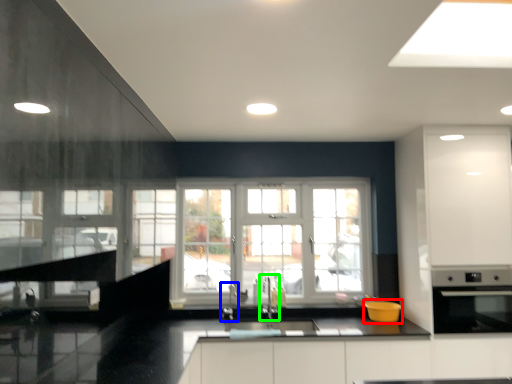
Question: Based on their relative distances, which object is nearer to appliance (highlighted by a red box)? Choose from faucet (highlighted by a blue box) and faucet (highlighted by a green box).

Choices:
 (A) faucet
 (B) faucet

Answer: (B)